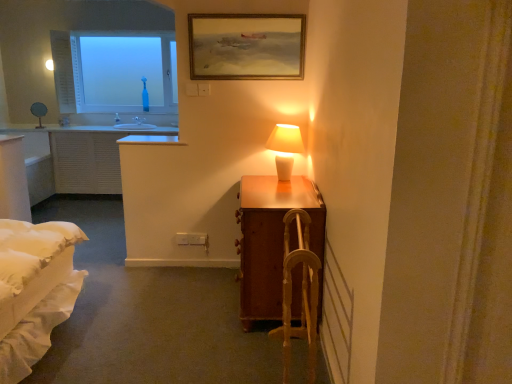
Locate an element on the screen. vacant space situated above wooden framed painting at upper center (from a real-world perspective) is located at coordinates (247, 4).